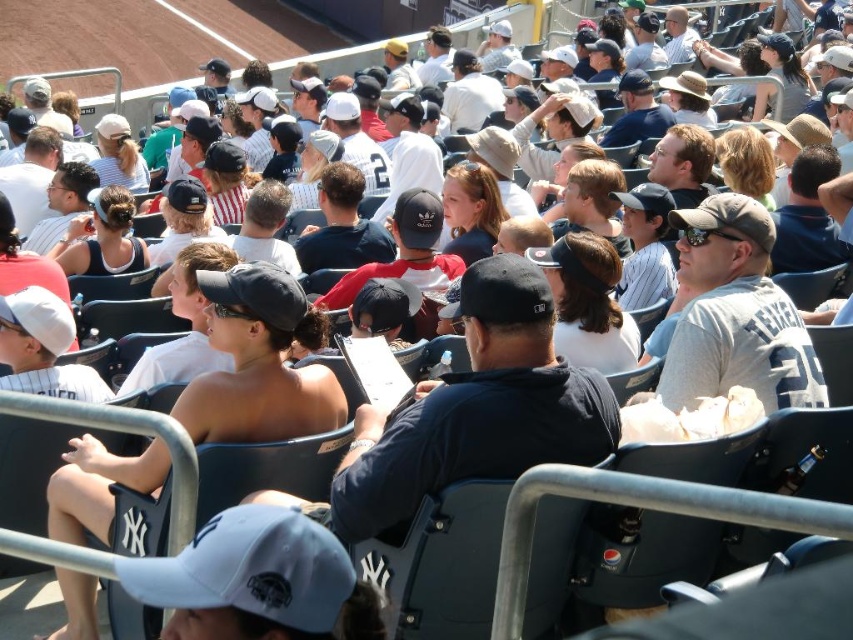
Question: Does matte black tank top at center appear under matte white cap at upper left?

Choices:
 (A) yes
 (B) no

Answer: (A)

Question: Which object is the closest to the gray cotton t-shirt at center?

Choices:
 (A) matte black tank top at center
 (B) matte white cap at upper left

Answer: (A)

Question: Can you confirm if matte black cap at center is smaller than matte white cap at upper left?

Choices:
 (A) no
 (B) yes

Answer: (B)

Question: Which point is farther to the camera?

Choices:
 (A) matte black tank top at center
 (B) gray cotton t-shirt at center
 (C) dark brown hair at center

Answer: (C)

Question: Is matte black cap at center above matte black tank top at center?

Choices:
 (A) yes
 (B) no

Answer: (B)

Question: Which object is the farthest from the gray cotton t-shirt at center?

Choices:
 (A) blonde hair at center
 (B) matte white cap at upper left

Answer: (B)